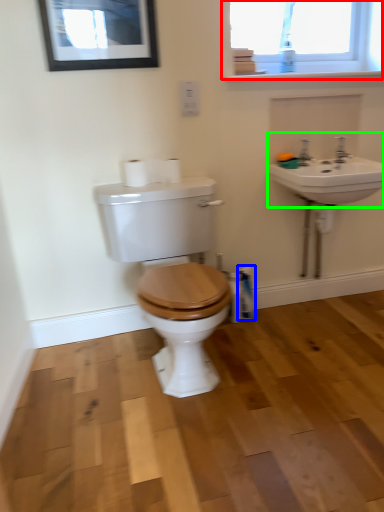
Question: Which is nearer to the window (highlighted by a red box)? cleaning product (highlighted by a blue box) or sink (highlighted by a green box).

Choices:
 (A) cleaning product
 (B) sink

Answer: (B)